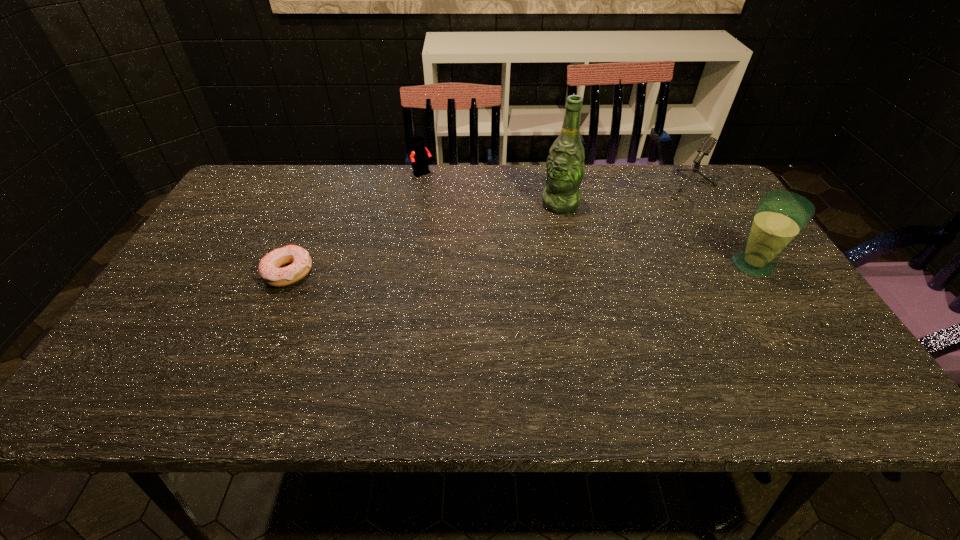
I want to click on doughnut, so coord(269,271).

You are a GUI agent. You are given a task and a screenshot of the screen. Output one action in this format:
    pyautogui.click(x=<x>, y=<y>)
    Task: Click on the shortest object
    This screenshot has width=960, height=540.
    Given the screenshot: What is the action you would take?
    pyautogui.click(x=269, y=271)

Find the location of a particular element. Image resolution: width=960 pixels, height=540 pixels. the fourth shortest object is located at coordinates (780, 216).

This screenshot has height=540, width=960. What are the coordinates of `Lego` in the screenshot? It's located at (420, 155).

Identify the location of microphone. (706, 147).

Image resolution: width=960 pixels, height=540 pixels. Identify the location of the third object from right to left. point(565,165).

Where is `beer bottle`? The height and width of the screenshot is (540, 960). beer bottle is located at coordinates (565, 165).

Image resolution: width=960 pixels, height=540 pixels. I want to click on vacant space located 0.160m on the back of the shortest object, so click(x=314, y=218).

Identify the location of vacant space located on the left of the glass. This screenshot has height=540, width=960. (593, 265).

Locate an element on the screen. The image size is (960, 540). vacant area situated on the front-facing side of the second object from left to right is located at coordinates (444, 198).